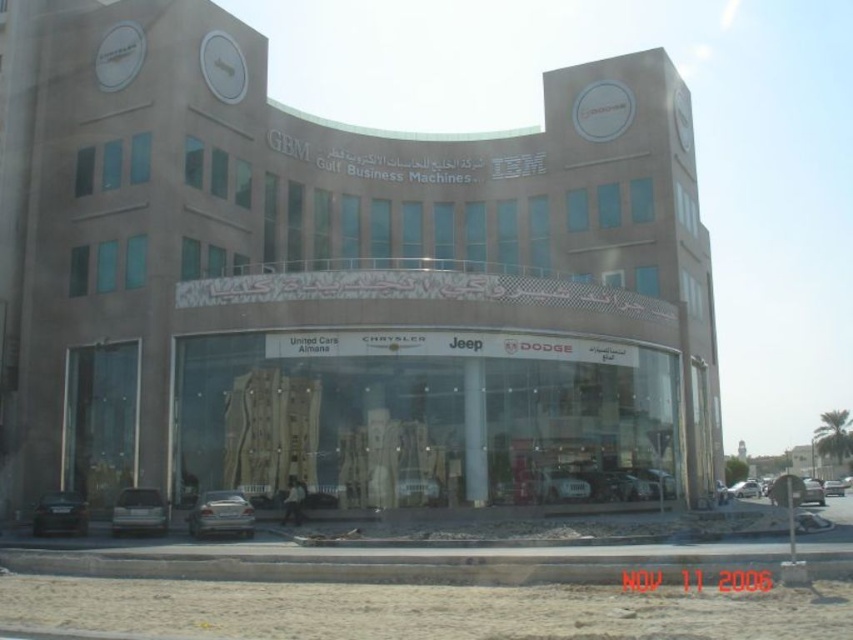
Question: Which point is closer to the camera?

Choices:
 (A) silver metallic sedan at lower left
 (B) satin silver sedan at lower center

Answer: (B)

Question: Can you confirm if matte glass storefront at center is thinner than dark gray metallic sedan at lower left?

Choices:
 (A) yes
 (B) no

Answer: (B)

Question: Among these points, which one is nearest to the camera?

Choices:
 (A) (550, 205)
 (B) (123, 522)
 (C) (51, 516)
 (D) (229, 509)

Answer: (D)

Question: Which point appears closest to the camera in this image?

Choices:
 (A) (241, 525)
 (B) (471, 134)
 (C) (155, 508)
 (D) (76, 532)

Answer: (A)

Question: Can you confirm if satin silver sedan at lower center is positioned below silver metallic sedan at lower left?

Choices:
 (A) no
 (B) yes

Answer: (B)

Question: Does matte glass storefront at center come in front of silver metallic sedan at lower left?

Choices:
 (A) no
 (B) yes

Answer: (A)